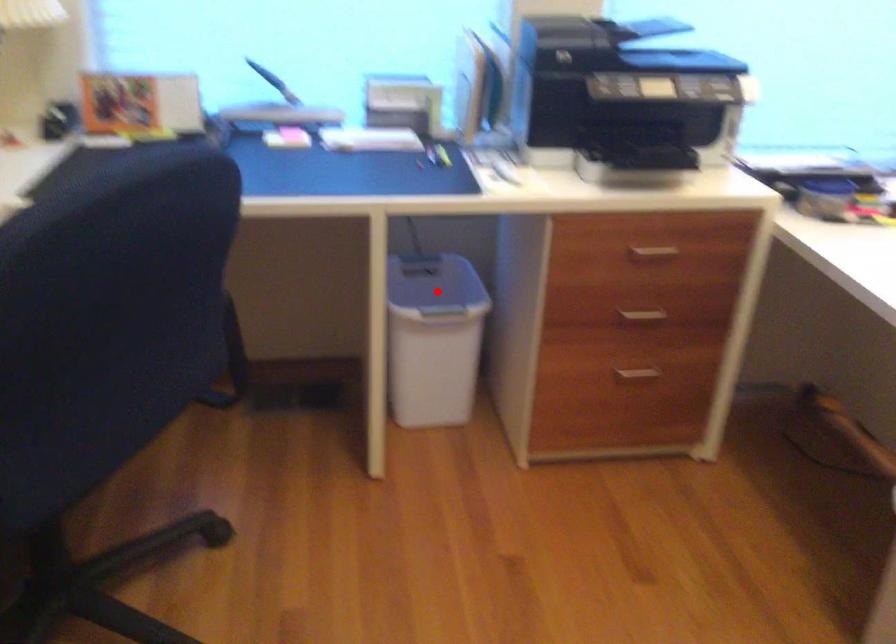
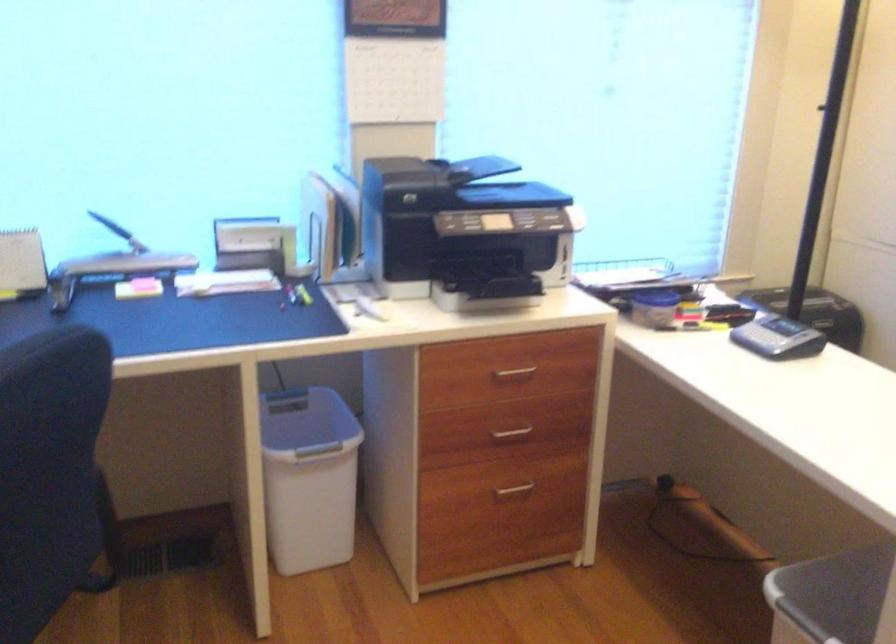
The point at the highlighted location is marked in the first image. Where is the corresponding point in the second image?

(306, 424)